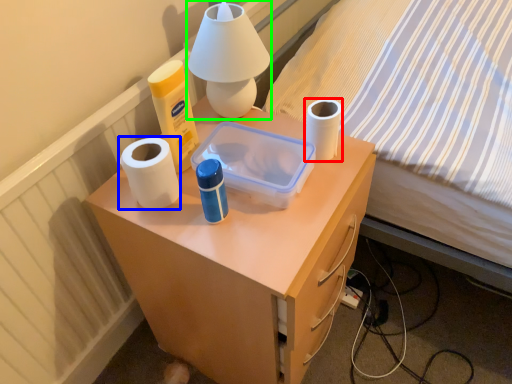
Question: Which object is the closest to the toilet paper (highlighted by a red box)? Choose among these: paper towel (highlighted by a blue box) or table lamp (highlighted by a green box).

Choices:
 (A) paper towel
 (B) table lamp

Answer: (B)